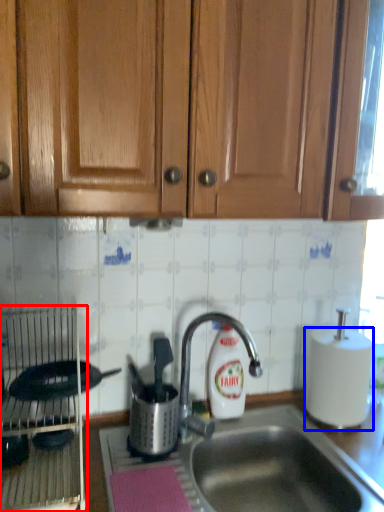
Question: Which object is further to the camera taking this photo, appliance (highlighted by a red box) or paper towel (highlighted by a blue box)?

Choices:
 (A) appliance
 (B) paper towel

Answer: (B)